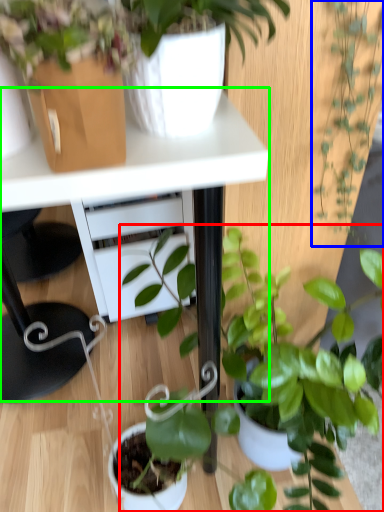
Question: Which is nearer to the houseplant (highlighted by a red box)? houseplant (highlighted by a blue box) or table (highlighted by a green box).

Choices:
 (A) houseplant
 (B) table

Answer: (A)